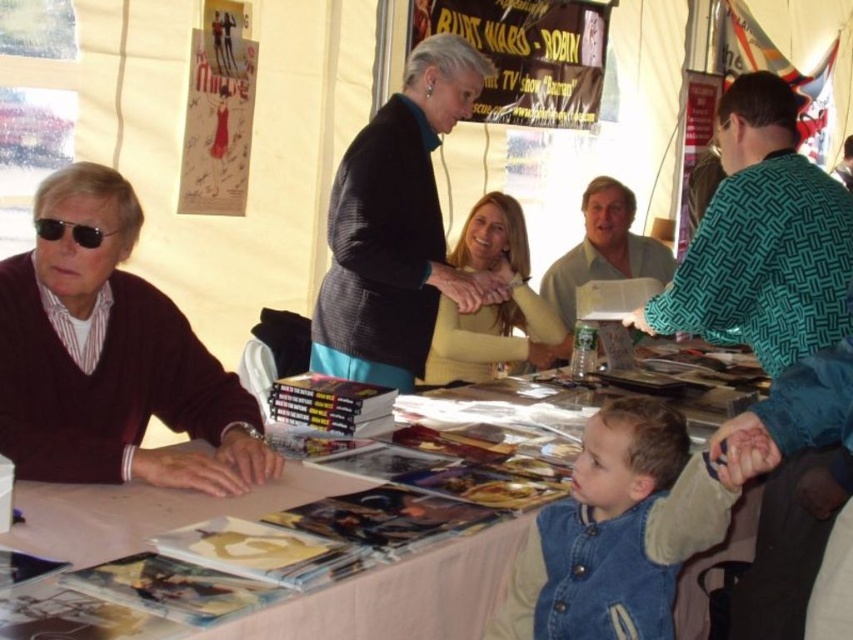
The width and height of the screenshot is (853, 640). Describe the element at coordinates (111, 358) in the screenshot. I see `maroon sweater at left` at that location.

In order to click on maroon sweater at left in this screenshot , I will do `click(111, 358)`.

Is denim jacket at lower right thinner than black plastic sunglasses at left?

No.

Is the position of denim jacket at lower right more distant than that of black plastic sunglasses at left?

No, it is in front of black plastic sunglasses at left.

Between point (648, 628) and point (42, 225), which one is positioned behind?

The point (42, 225) is behind.

At what (x,y) coordinates should I click in order to perform the action: click on denim jacket at lower right. Please return your answer as a coordinate pair (x, y). The height and width of the screenshot is (640, 853). Looking at the image, I should click on (618, 532).

Find the location of `black textured sweater at center`. black textured sweater at center is located at coordinates (396, 227).

Who is taller, black textured sweater at center or matte yellow sweater at center?

black textured sweater at center

This screenshot has width=853, height=640. Identify the location of black textured sweater at center. (396, 227).

Locate an element on the screen. The height and width of the screenshot is (640, 853). black textured sweater at center is located at coordinates (396, 227).